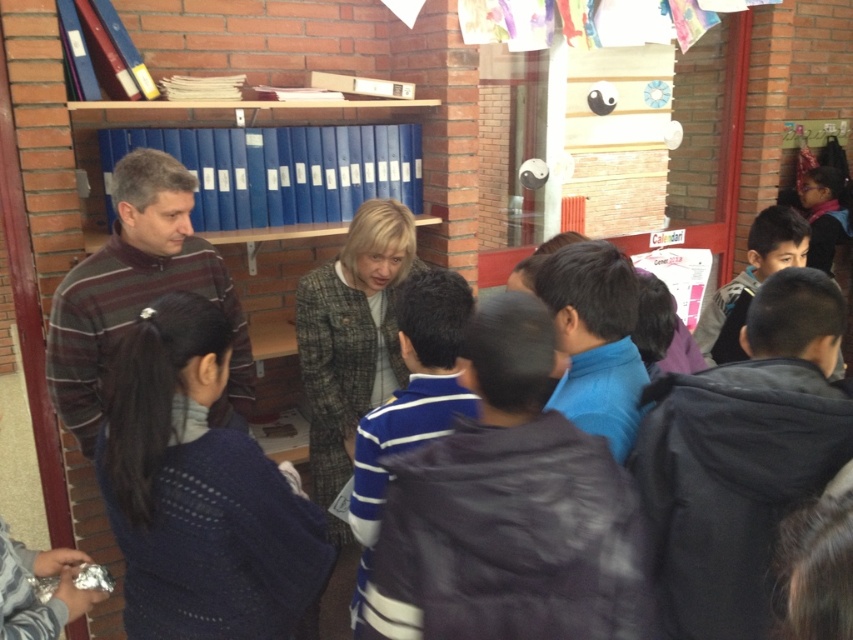
Does knitted blue sweater at lower left have a greater height compared to gray tweed jacket at center?

No, knitted blue sweater at lower left is not taller than gray tweed jacket at center.

Who is more forward, (201,634) or (360,336)?

Point (201,634) is more forward.

Which is behind, point (175, 525) or point (357, 225)?

Positioned behind is point (357, 225).

At what (x,y) coordinates should I click in order to perform the action: click on knitted blue sweater at lower left. Please return your answer as a coordinate pair (x, y). The width and height of the screenshot is (853, 640). Looking at the image, I should click on (199, 492).

Can you confirm if striped wool sweater at left is shorter than blue plastic file folders at upper center?

Incorrect, striped wool sweater at left's height does not fall short of blue plastic file folders at upper center's.

Does striped wool sweater at left appear on the right side of blue plastic file folders at upper center?

Incorrect, striped wool sweater at left is not on the right side of blue plastic file folders at upper center.

Is point (186, 272) positioned before point (252, 118)?

Yes, it is in front of point (252, 118).

Image resolution: width=853 pixels, height=640 pixels. In order to click on striped wool sweater at left in this screenshot , I will do `click(138, 292)`.

Who is positioned more to the right, gray tweed jacket at center or blue plastic file folders at upper center?

gray tweed jacket at center is more to the right.

Measure the distance from gray tweed jacket at center to blue plastic file folders at upper center.

gray tweed jacket at center is 84.61 centimeters from blue plastic file folders at upper center.

Which is behind, point (318, 344) or point (300, 108)?

Positioned behind is point (300, 108).

In order to click on gray tweed jacket at center in this screenshot , I will do `click(351, 336)`.